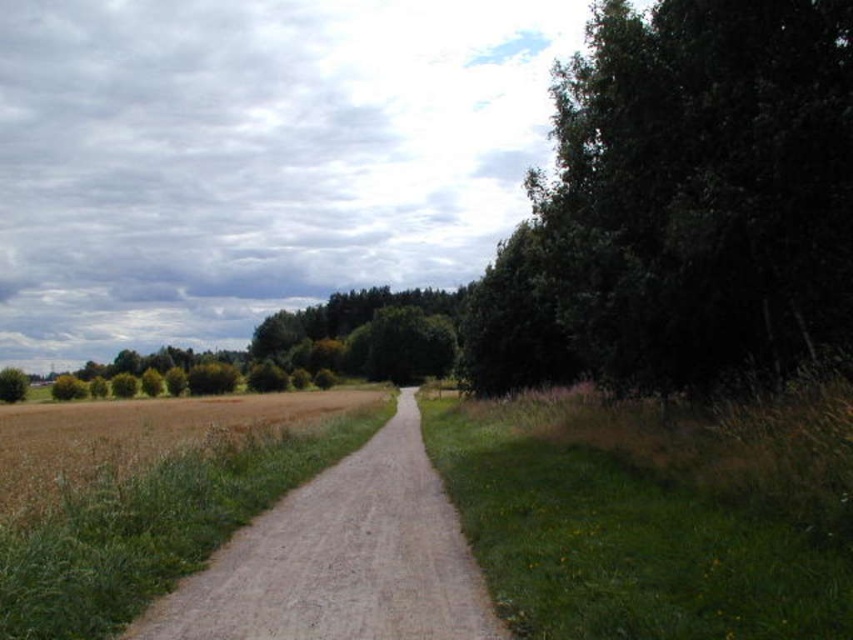
Can you confirm if green leafy tree at right is positioned to the right of dirt/gravel path at center?

Yes, green leafy tree at right is to the right of dirt/gravel path at center.

Does green leafy tree at right have a lesser height compared to dirt/gravel path at center?

No.

The image size is (853, 640). What are the coordinates of `green leafy tree at right` in the screenshot? It's located at (682, 204).

Who is taller, green grass at right or dirt/gravel path at center?

dirt/gravel path at center

Does point (634, 513) come farther from viewer compared to point (270, 612)?

Yes, it is behind point (270, 612).

Image resolution: width=853 pixels, height=640 pixels. What do you see at coordinates (624, 544) in the screenshot?
I see `green grass at right` at bounding box center [624, 544].

Find the location of a particular element. green grass at right is located at coordinates (624, 544).

Between dirt/gravel path at center and green leafy tree at left, which one has less height?

With less height is dirt/gravel path at center.

Can you confirm if dirt/gravel path at center is wider than green leafy tree at left?

No.

Is point (161, 634) behind point (16, 387)?

No, (161, 634) is closer to viewer.

At what (x,y) coordinates should I click in order to perform the action: click on dirt/gravel path at center. Please return your answer as a coordinate pair (x, y). The width and height of the screenshot is (853, 640). Looking at the image, I should click on (341, 557).